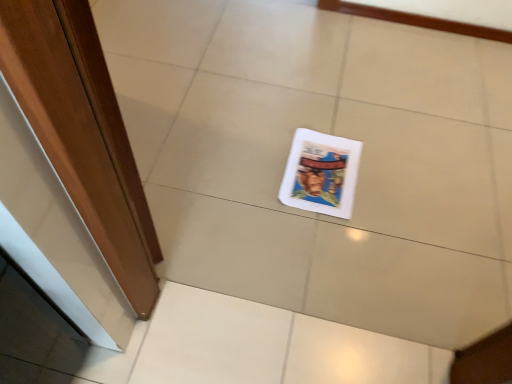
The height and width of the screenshot is (384, 512). What are the coordinates of `vacant region above white glossy magazine at center (from a real-world perspective)` in the screenshot? It's located at (325, 169).